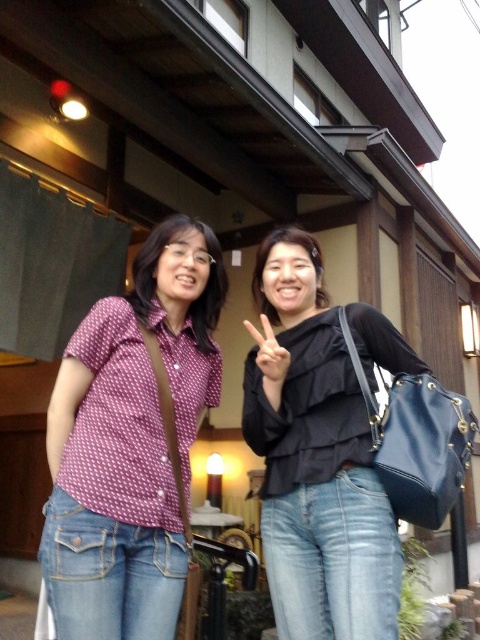
You are standing 10 feet away from the building in the image. You want to take a photo of the matte black blouse at center without including the building in the frame. Is the distance sufficient to ensure the blouse is in focus while the building is out of focus?

Result: The matte black blouse at center is 6.60 feet from the viewer. Since you are 10 feet away from the building, the distance between the blouse and the building is not specified, but to achieve focus on the blouse while keeping the building out of focus, the blouse should be significantly closer to you than the building. Given the blouse is 6.60 feet away and you are 10 feet from the building, there is a 3.4 feet difference, which might be enough depending on lens aperture. However, the exact focus range isn

You are a photographer setting up a shoot in front of a traditional Japanese building. You notice two subjects in the scene. One is wearing a matte black blouse at center and the other has a white matte hand at center. From the perspective of someone standing directly in front of the building, which object is positioned higher?

The matte black blouse at center is positioned higher than the white matte hand at center.